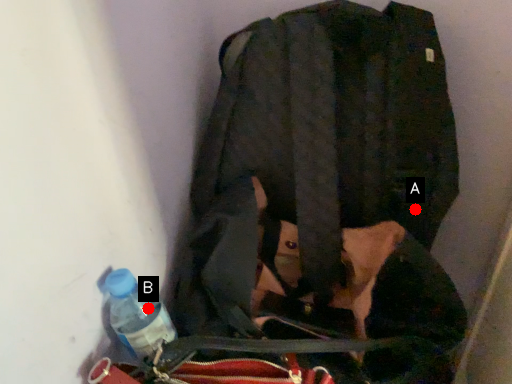
Question: Two points are circled on the image, labeled by A and B beside each circle. Which of the following is the farthest from the observer?

Choices:
 (A) A is further
 (B) B is further

Answer: (A)